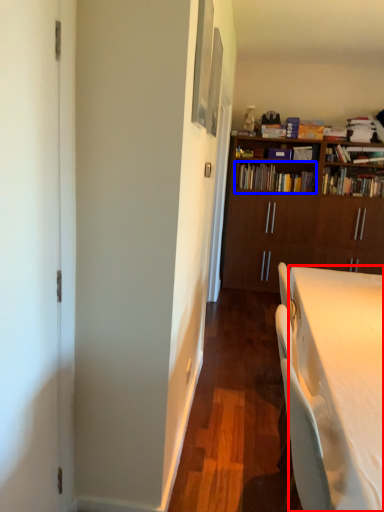
Question: Which of the following is the farthest to the observer, desk (highlighted by a red box) or book (highlighted by a blue box)?

Choices:
 (A) desk
 (B) book

Answer: (B)